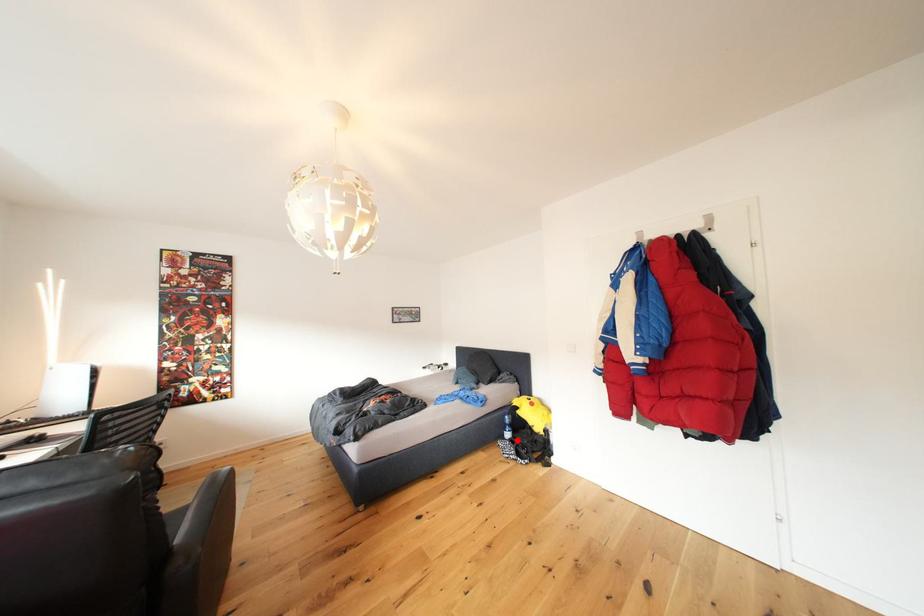
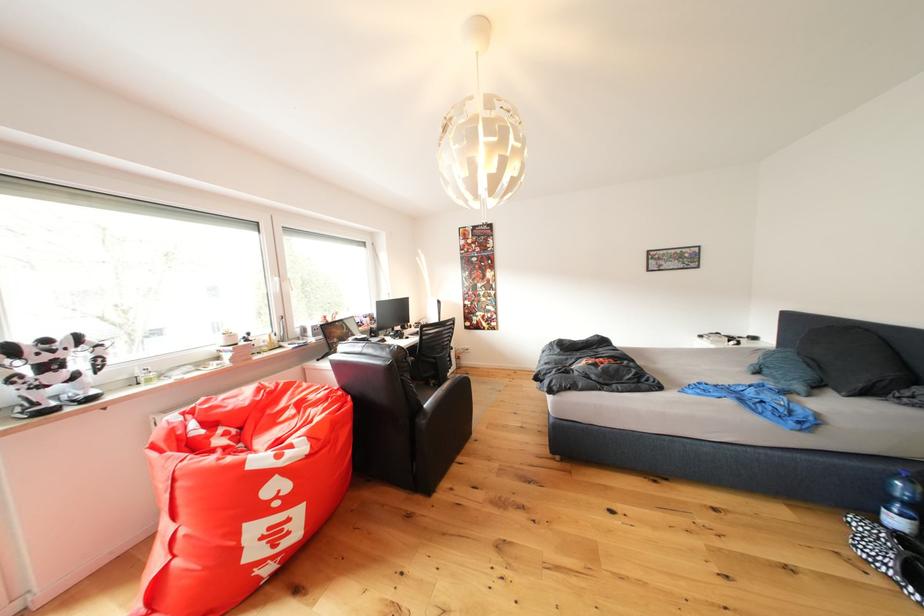
Question: I am providing you with two images of the same scene from different viewpoints. Given a red point in image1, look at the same physical point in image2. Is it:

Choices:
 (A) Closer to the viewpoint
 (B) Farther from the viewpoint

Answer: (A)